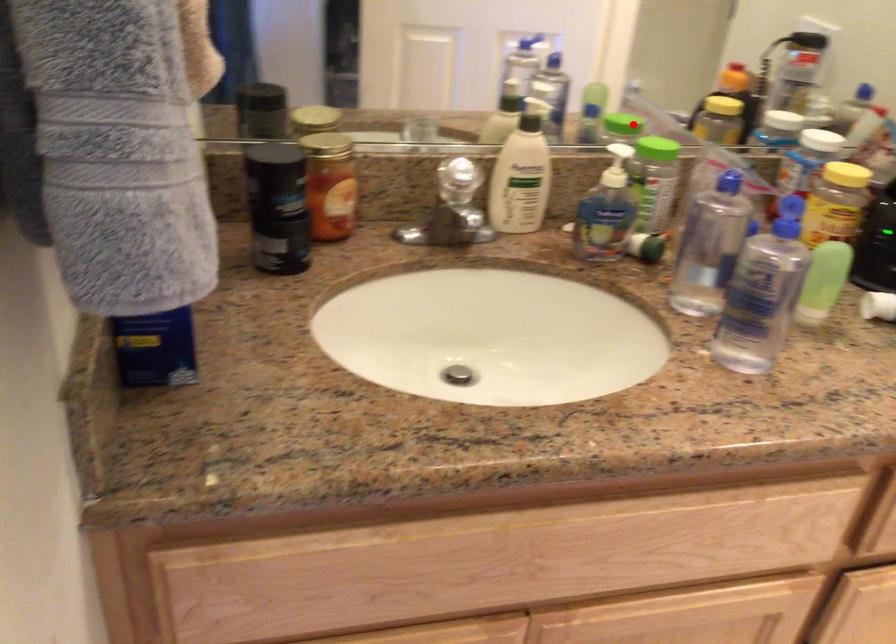
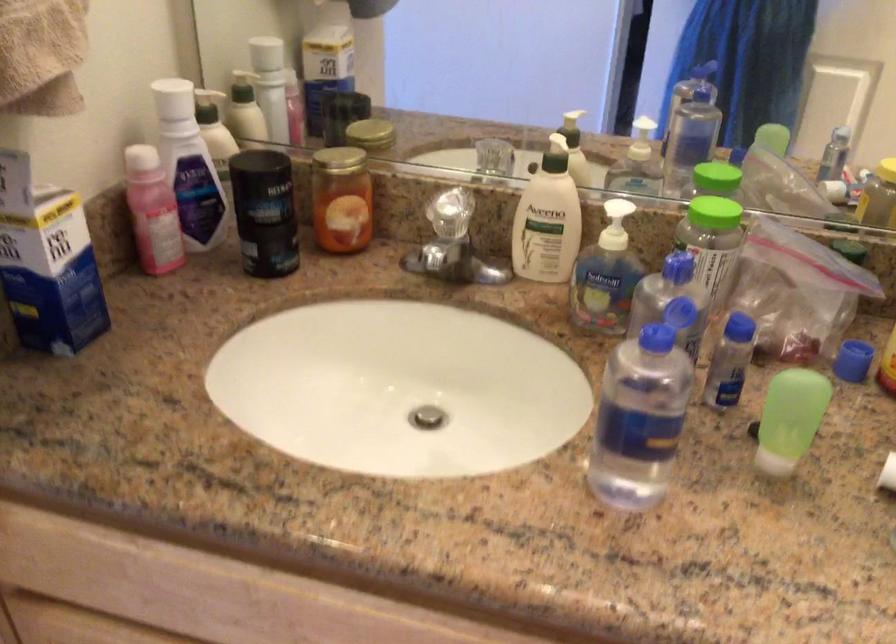
Find the pixel in the second image that matches the highlighted location in the first image.

(716, 178)